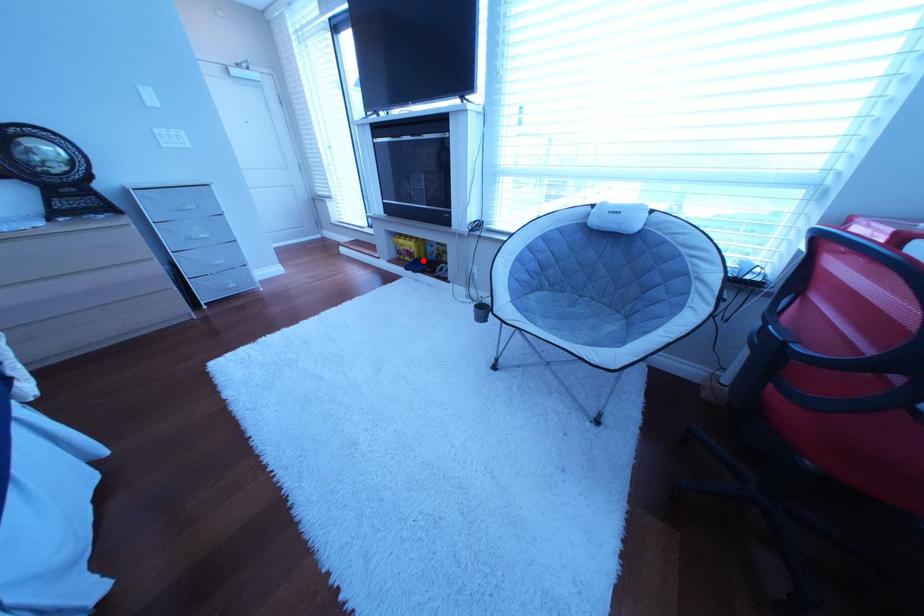
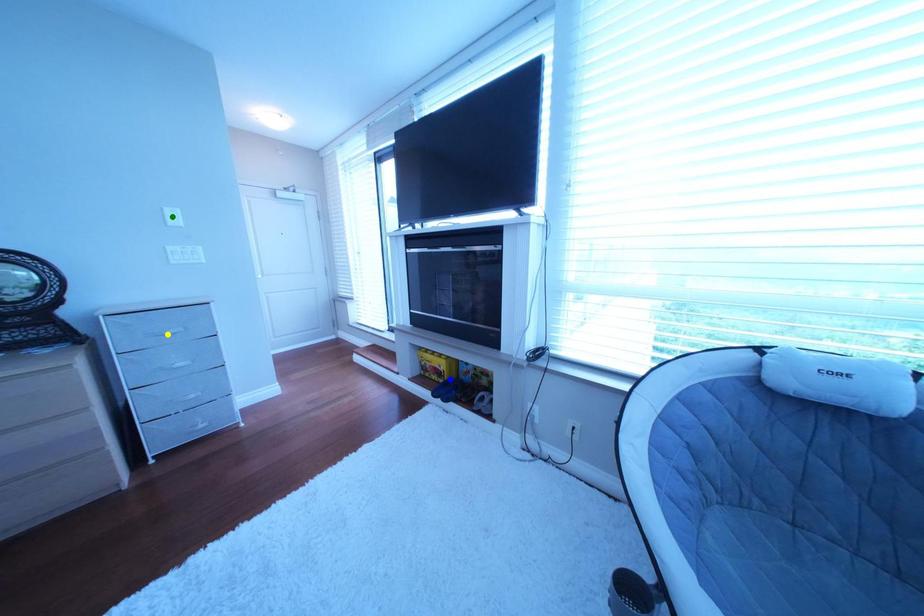
Question: I am providing you with two images of the same scene from different viewpoints. A red point is marked on the first image. You are given multiple points on the second image. In image 2, which mark is for the same physical point as the one in image 1?

Choices:
 (A) yellow point
 (B) green point
 (C) blue point

Answer: (C)